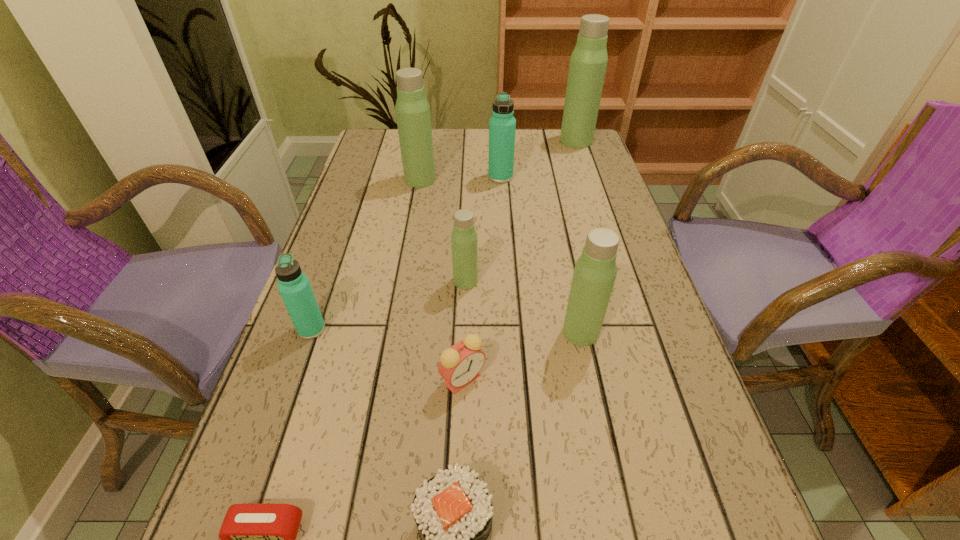
Identify the location of free location located on the face of the bigger pink alarm clock. (459, 510).

At what (x,y) coordinates should I click in order to perform the action: click on object situated at the far edge. Please return your answer as a coordinate pair (x, y). Looking at the image, I should click on (588, 62).

Locate an element on the screen. object located in the far right corner section of the desktop is located at coordinates (588, 62).

At what (x,y) coordinates should I click in order to perform the action: click on vacant area at the far edge of the desktop. Please return your answer as a coordinate pair (x, y). The image size is (960, 540). Looking at the image, I should click on (523, 150).

The width and height of the screenshot is (960, 540). In order to click on blank area at the left edge in this screenshot , I will do `click(361, 166)`.

At what (x,y) coordinates should I click in order to perform the action: click on blank space at the far right corner. Please return your answer as a coordinate pair (x, y). The width and height of the screenshot is (960, 540). Looking at the image, I should click on (558, 157).

This screenshot has width=960, height=540. I want to click on free space between the bigger pink alarm clock and the nearer aqua thermos bottle, so click(387, 354).

Where is `free space between the third light thermos bottle from right to left and the farther aqua thermos bottle`? The height and width of the screenshot is (540, 960). free space between the third light thermos bottle from right to left and the farther aqua thermos bottle is located at coordinates (483, 229).

What are the coordinates of `vacant area that lies between the second smallest light thermos bottle and the second biggest light thermos bottle` in the screenshot? It's located at (500, 256).

Identify which object is the closest to the second thermos bottle from right to left. Please provide its 2D coordinates. Your answer should be formatted as a tuple, i.e. [(x, y)], where the tuple contains the x and y coordinates of a point satisfying the conditions above.

[(459, 365)]